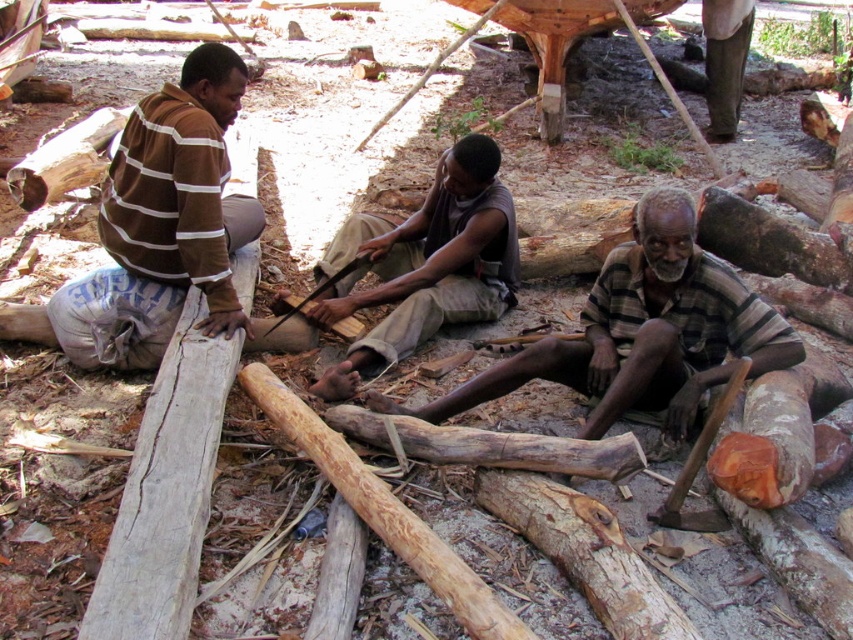
Does striped fabric shirt at center have a greater height compared to smooth brown wood at center?

No, striped fabric shirt at center is not taller than smooth brown wood at center.

Who is positioned more to the right, striped fabric shirt at center or smooth brown wood at center?

striped fabric shirt at center

Measure the distance between point (631, 262) and camera.

They are 3.26 meters apart.

The height and width of the screenshot is (640, 853). Identify the location of striped fabric shirt at center. (642, 332).

Is brown striped sweater at left to the right of striped fabric shirt at center from the viewer's perspective?

No, brown striped sweater at left is not to the right of striped fabric shirt at center.

At what (x,y) coordinates should I click in order to perform the action: click on brown striped sweater at left. Please return your answer as a coordinate pair (x, y). This screenshot has height=640, width=853. Looking at the image, I should click on (164, 224).

Does brown striped sweater at left lie in front of smooth brown wood at center?

Yes, brown striped sweater at left is in front of smooth brown wood at center.

Does brown striped sweater at left have a greater width compared to smooth brown wood at center?

No, brown striped sweater at left is not wider than smooth brown wood at center.

Is point (216, 216) in front of point (350, 365)?

Yes, point (216, 216) is in front of point (350, 365).

Find the location of a particular element. brown striped sweater at left is located at coordinates (164, 224).